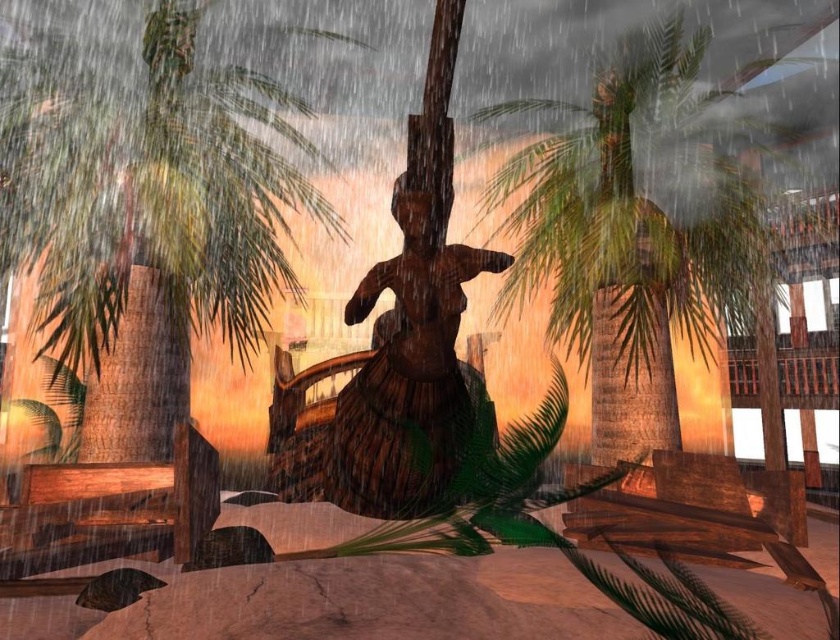
Who is positioned more to the right, green leafy palm tree at left or green leafy palm tree at center?

Positioned to the right is green leafy palm tree at center.

Is point (34, 161) farther from viewer compared to point (744, 148)?

That is False.

Who is more distant from viewer, (11, 150) or (610, 168)?

Point (610, 168)

The width and height of the screenshot is (840, 640). I want to click on green leafy palm tree at left, so click(140, 202).

Who is higher up, green leafy palm tree at center or wooden statue at center?

green leafy palm tree at center is higher up.

Does green leafy palm tree at center appear on the right side of wooden statue at center?

Correct, you'll find green leafy palm tree at center to the right of wooden statue at center.

You are a GUI agent. You are given a task and a screenshot of the screen. Output one action in this format:
    pyautogui.click(x=<x>, y=<y>)
    Task: Click on the green leafy palm tree at center
    This screenshot has height=640, width=840.
    Given the screenshot: What is the action you would take?
    pyautogui.click(x=639, y=212)

Does green leafy palm tree at left appear under wooden statue at center?

No.

Where is `green leafy palm tree at left`? The image size is (840, 640). green leafy palm tree at left is located at coordinates (140, 202).

In order to click on green leafy palm tree at left in this screenshot , I will do `click(140, 202)`.